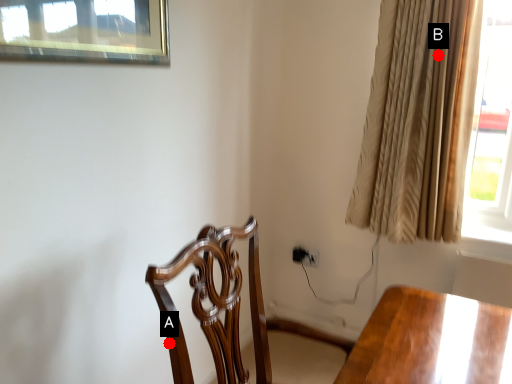
Question: Two points are circled on the image, labeled by A and B beside each circle. Which point is further to the camera?

Choices:
 (A) A is further
 (B) B is further

Answer: (B)